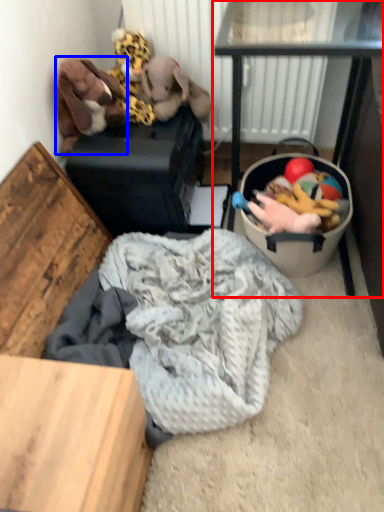
Question: Among these objects, which one is farthest to the camera, table (highlighted by a red box) or toy (highlighted by a blue box)?

Choices:
 (A) table
 (B) toy

Answer: (B)